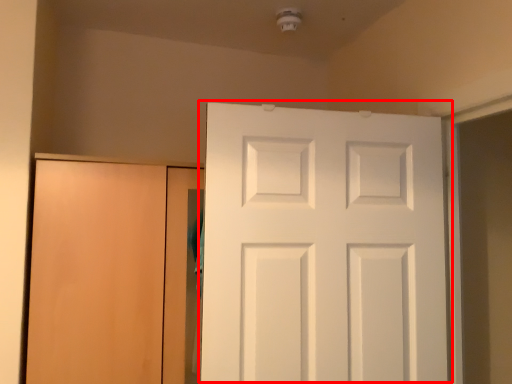
Question: From the image's perspective, what is the correct spatial positioning of door (annotated by the red box) in reference to door?

Choices:
 (A) above
 (B) below

Answer: (A)